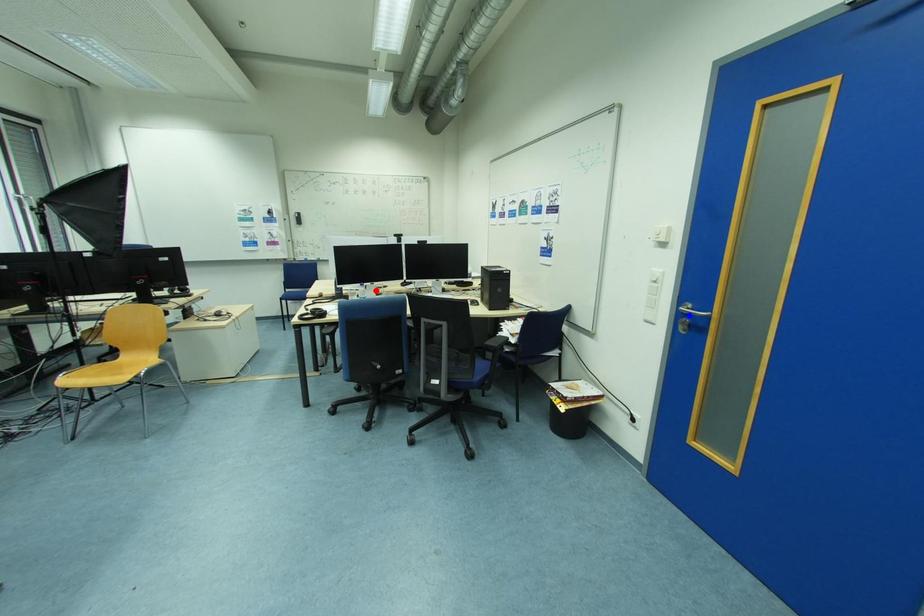
Question: In the image, two points are highlighted. Which point is nearer to the camera? Reply with the corresponding letter.

Choices:
 (A) blue point
 (B) red point

Answer: (A)